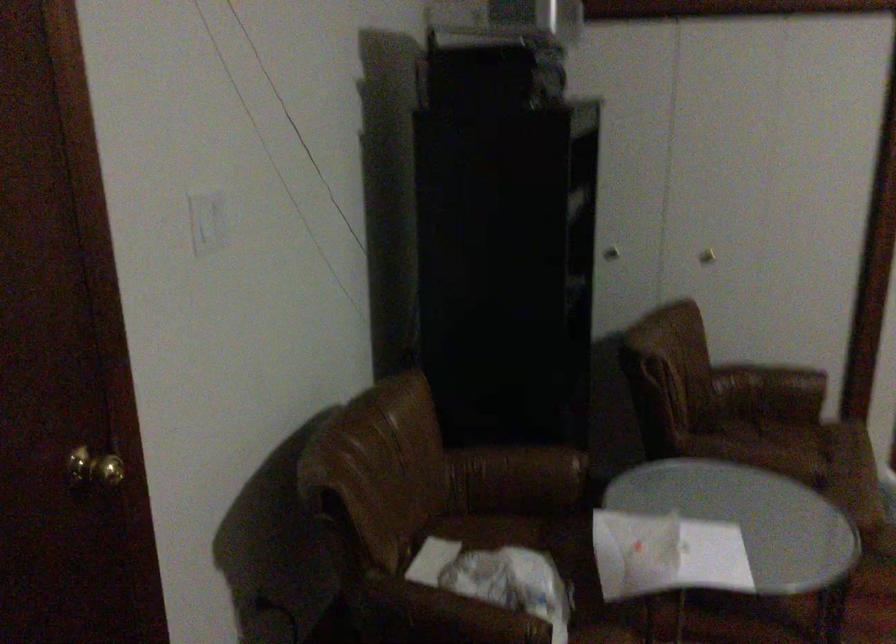
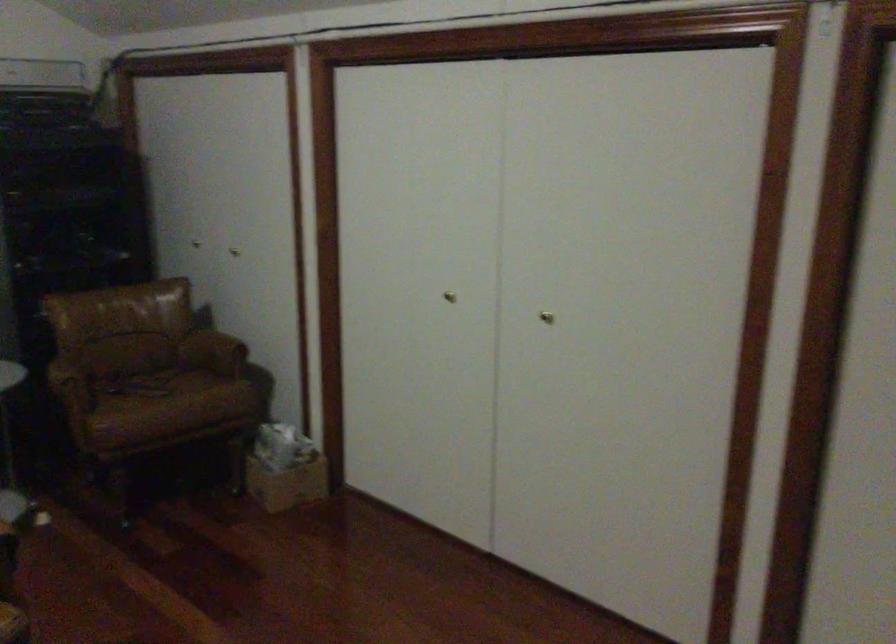
Locate, in the second image, the point that corresponds to (x=703, y=433) in the first image.

(149, 370)